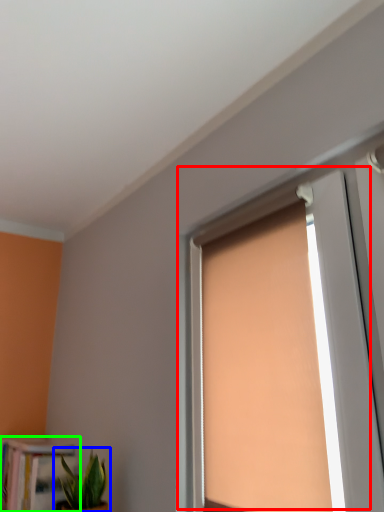
Question: Which is farther away from window (highlighted by a red box)? houseplant (highlighted by a blue box) or bookcase (highlighted by a green box)?

Choices:
 (A) houseplant
 (B) bookcase

Answer: (B)